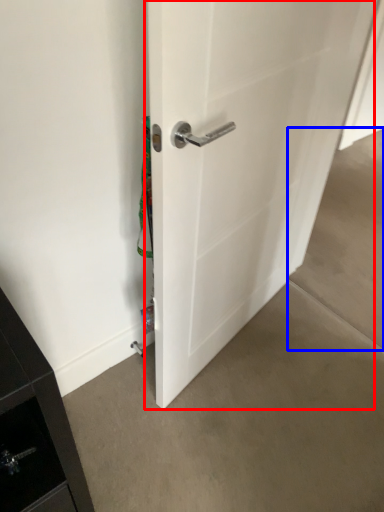
Question: Which point is closer to the camera, door (highlighted by a red box) or concrete (highlighted by a blue box)?

Choices:
 (A) door
 (B) concrete

Answer: (A)